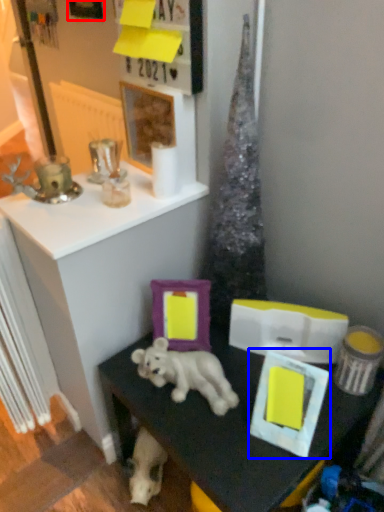
Question: Which object is further to the camera taking this photo, picture frame (highlighted by a red box) or picture frame (highlighted by a blue box)?

Choices:
 (A) picture frame
 (B) picture frame

Answer: (A)